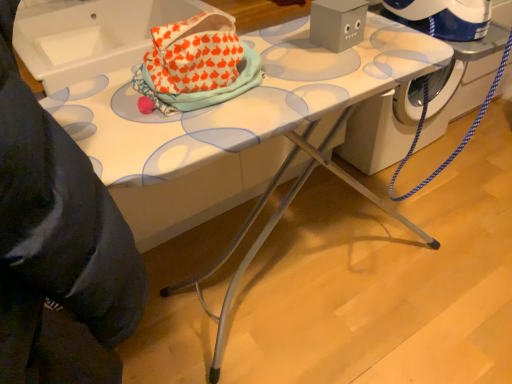
Question: Is white plastic washing machine at center bigger or smaller than white ceramic sink at upper left?

Choices:
 (A) small
 (B) big

Answer: (B)

Question: Would you say white plastic washing machine at center is inside or outside white ceramic sink at upper left?

Choices:
 (A) outside
 (B) inside

Answer: (A)

Question: Is point coord(458,79) closer or farther from the camera than point coord(18,13)?

Choices:
 (A) farther
 (B) closer

Answer: (A)

Question: Considering their positions, is white ceramic sink at upper left located in front of or behind white plastic washing machine at center?

Choices:
 (A) front
 (B) behind

Answer: (A)

Question: Is white ceramic sink at upper left to the left or to the right of white plastic washing machine at center in the image?

Choices:
 (A) left
 (B) right

Answer: (A)

Question: Considering the positions of white ceramic sink at upper left and white plastic washing machine at center in the image, is white ceramic sink at upper left taller or shorter than white plastic washing machine at center?

Choices:
 (A) short
 (B) tall

Answer: (A)

Question: Considering the positions of point (155, 13) and point (452, 86), is point (155, 13) closer or farther from the camera than point (452, 86)?

Choices:
 (A) closer
 (B) farther

Answer: (A)